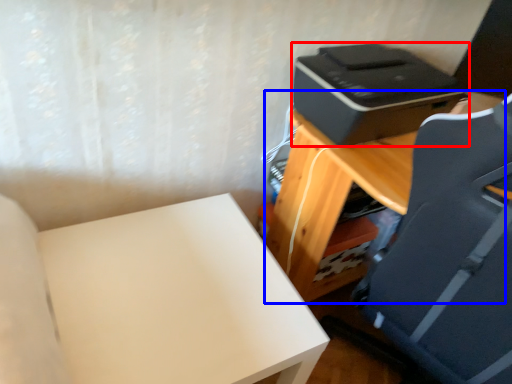
Question: Which point is further to the camera, printer (highlighted by a red box) or table (highlighted by a blue box)?

Choices:
 (A) printer
 (B) table

Answer: (A)